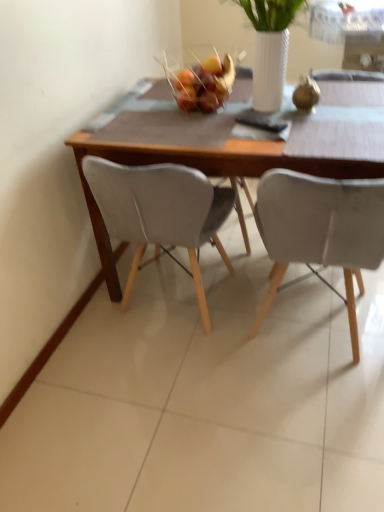
You are a GUI agent. You are given a task and a screenshot of the screen. Output one action in this format:
    pyautogui.click(x=<x>, y=<y>)
    Task: Click on the vacant space situated above wooden table at center (from a real-world perspective)
    
    Given the screenshot: What is the action you would take?
    255,113